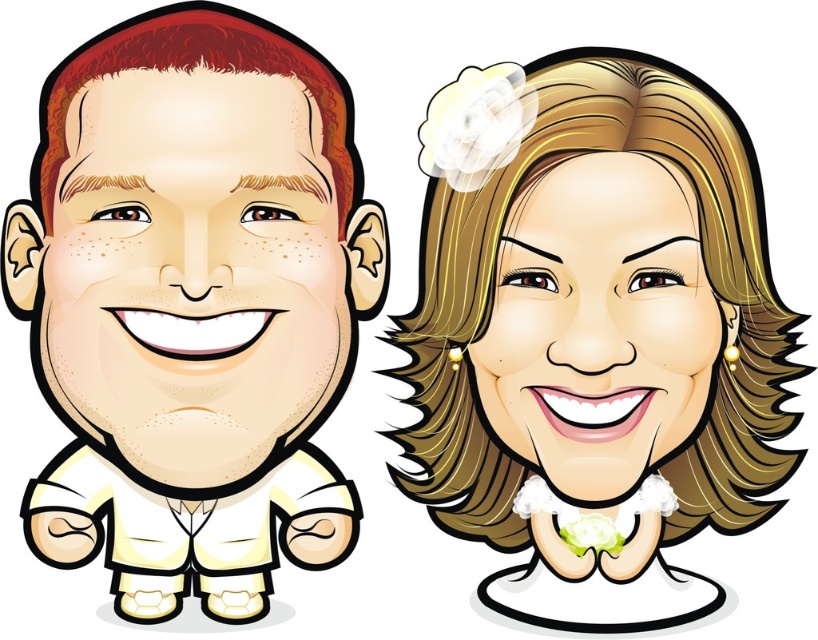
Is matte yellow face at left below smooth blonde hair at center?

Incorrect, matte yellow face at left is not positioned below smooth blonde hair at center.

Describe the element at coordinates (192, 269) in the screenshot. The height and width of the screenshot is (640, 818). I see `matte yellow face at left` at that location.

Between point (196, 298) and point (600, 230), which one is positioned in front?

Point (196, 298) is in front.

Locate an element on the screen. The height and width of the screenshot is (640, 818). matte yellow face at left is located at coordinates 192,269.

Measure the distance between smooth blonde hair at upper right and smooth blonde hair at center.

smooth blonde hair at upper right is 2.05 centimeters from smooth blonde hair at center.

Is smooth blonde hair at upper right in front of smooth blonde hair at center?

No.

Describe the element at coordinates (599, 326) in the screenshot. This screenshot has width=818, height=640. I see `smooth blonde hair at upper right` at that location.

The image size is (818, 640). What are the coordinates of `smooth blonde hair at upper right` in the screenshot? It's located at (599, 326).

Does point (645, 285) come closer to viewer compared to point (240, 387)?

No, (645, 285) is behind (240, 387).

Is point (640, 170) farther from camera compared to point (313, 225)?

That is True.

Is point (693, 454) closer to viewer compared to point (120, 189)?

That is False.

Locate an element on the screen. smooth blonde hair at upper right is located at coordinates (599, 326).